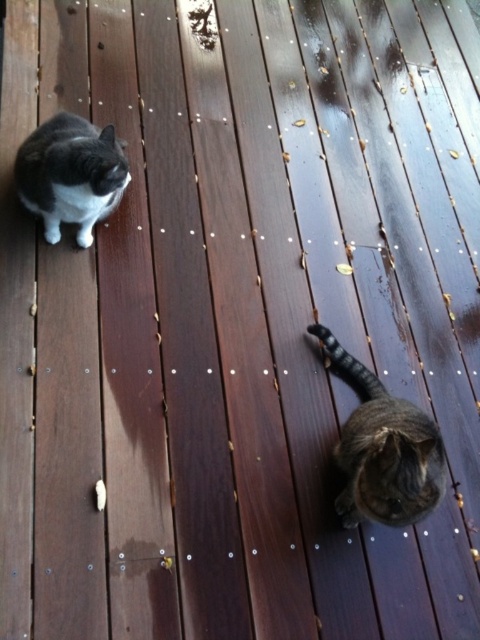
Based on the photo, you are standing at the center of the wooden deck. There is a black and white cat on the left and a brown fur cat at lower right. Which cat is closer to you?

The brown fur cat at lower right is closer to you because it is positioned at point [384,451], which is nearer to the center of the deck compared to the black and white cat on the left.